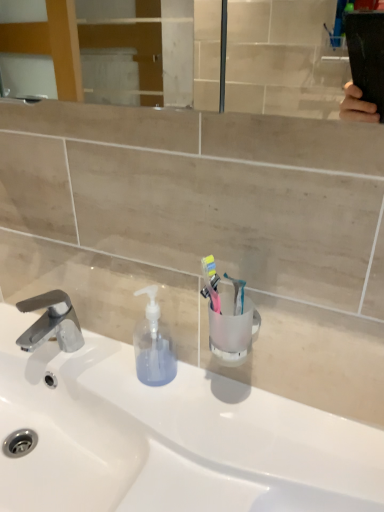
The image size is (384, 512). Identify the location of vacant area located to the right-hand side of chrome metallic faucet at left. (115, 374).